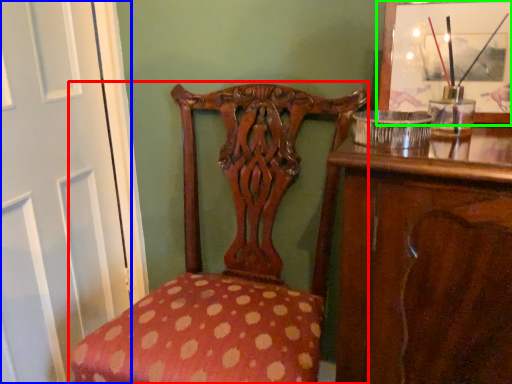
Question: Which object is the closest to the chair (highlighted by a red box)? Choose among these: screen door (highlighted by a blue box) or picture frame (highlighted by a green box).

Choices:
 (A) screen door
 (B) picture frame

Answer: (A)